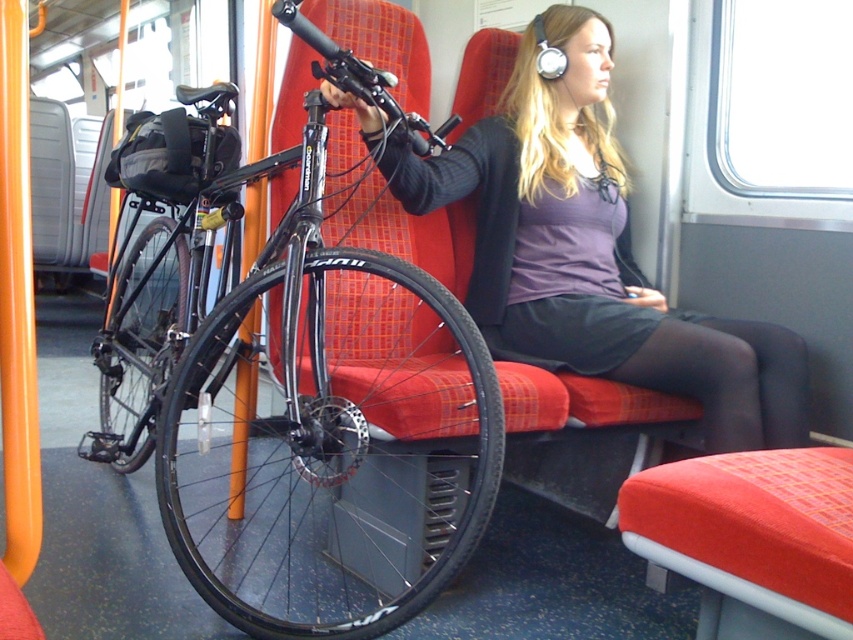
You are a passenger on the train and need to store your belongings. You have a shiny black bicycle at left and a matte black jacket at center in view. Which item takes up more space?

The shiny black bicycle at left is bigger than the matte black jacket at center, so it takes up more space.

Based on the photo, you are a passenger on this train and need to place your matte black jacket at center on the seat. However, there is a shiny black bicycle at left in the way. Can you move the jacket to the seat without moving the bicycle?

The shiny black bicycle at left is positioned on the left side of matte black jacket at center. Since the bicycle is to the left of the jacket, you can move the jacket to the seat by moving it around the right side of the bicycle.

You are a passenger on a train and need to store your matte black jacket at center. Where should you place it so that it doesn not block the aisle? The shiny black bicycle at left is in the way.

The shiny black bicycle at left is below the matte black jacket at center, so you can place the matte black jacket at center on the bicycle to avoid blocking the aisle.